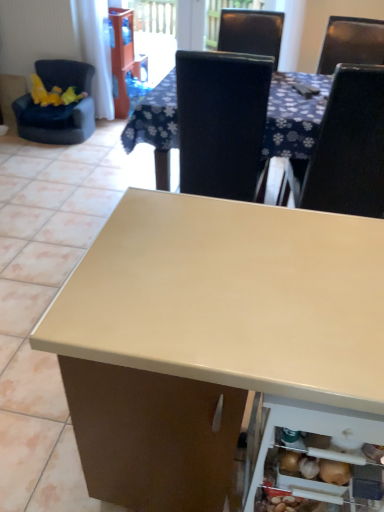
Question: In terms of width, does velvet-like black armchair at left, marked as the 2th chair in a right-to-left arrangement, look wider or thinner when compared to transparent plastic screen door at upper center?

Choices:
 (A) thin
 (B) wide

Answer: (B)

Question: Considering the positions of velvet-like black armchair at left, which ranks as the second chair in front-to-back order, and transparent plastic screen door at upper center in the image, is velvet-like black armchair at left, which ranks as the second chair in front-to-back order, taller or shorter than transparent plastic screen door at upper center?

Choices:
 (A) short
 (B) tall

Answer: (A)

Question: Which object is positioned closest to the beige laminate table at center?

Choices:
 (A) white fabric curtain at upper left
 (B) transparent plastic screen door at upper center
 (C) black leather chair at upper right, which appears as the 1th chair when viewed from the front
 (D) white plastic shelf at lower right
 (E) velvet-like black armchair at left, which is the 1th chair from back to front

Answer: (D)

Question: Considering the real-world distances, which object is closest to the velvet-like black armchair at left, which is the 1th chair from back to front?

Choices:
 (A) black leather chair at upper right, positioned as the second chair in left-to-right order
 (B) white plastic shelf at lower right
 (C) transparent plastic screen door at upper center
 (D) beige laminate table at center
 (E) white fabric curtain at upper left

Answer: (E)